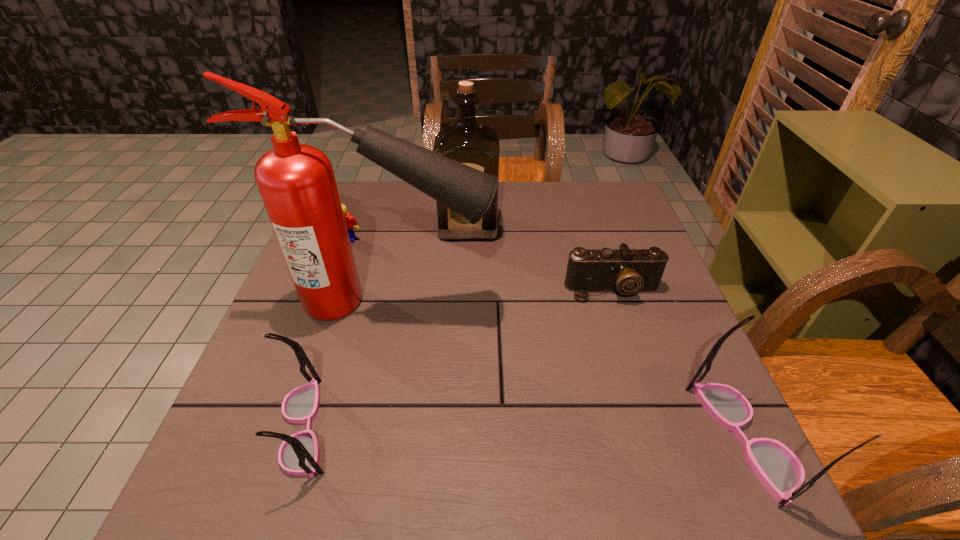
If the aim is uniform spacing by inserting an additional spectacles among them, please point to a vacant space for this new spectacles. Please provide its 2D coordinates. Your answer should be formatted as a tuple, i.e. [(x, y)], where the tuple contains the x and y coordinates of a point satisfying the conditions above.

[(523, 433)]